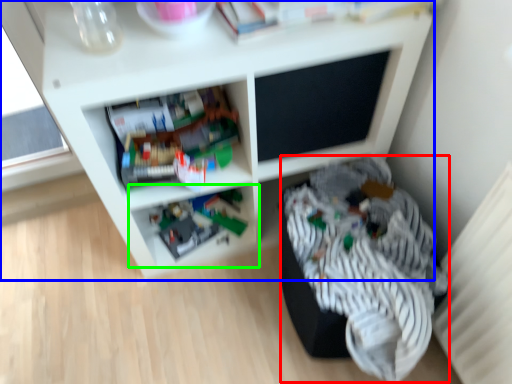
Question: Which object is positioned closest to clothing (highlighted by a red box)? Select from shelf (highlighted by a blue box) and shelf (highlighted by a green box).

Choices:
 (A) shelf
 (B) shelf

Answer: (A)